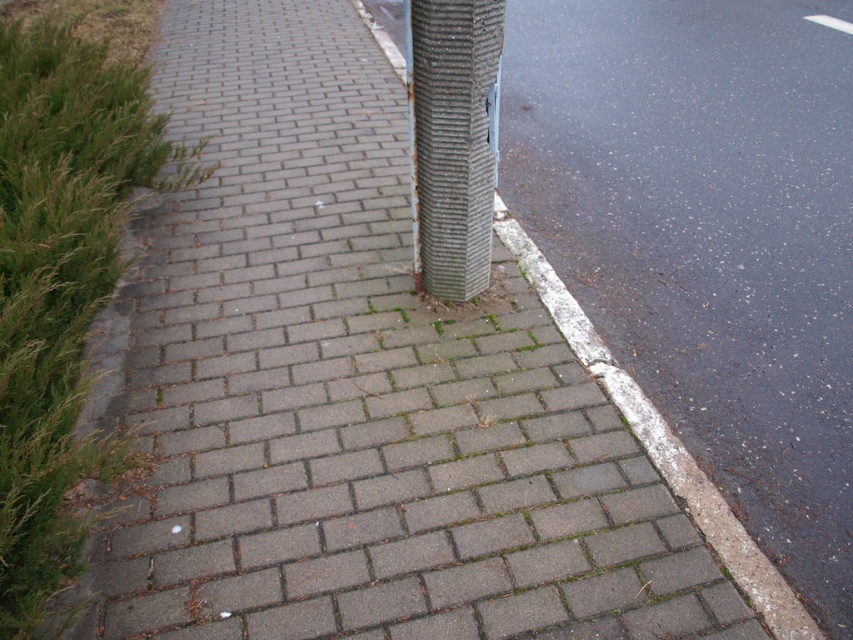
Is rough textured pole at center bigger than white concrete curb at lower right?

Incorrect, rough textured pole at center is not larger than white concrete curb at lower right.

Between rough textured pole at center and white concrete curb at lower right, which one has less height?

With less height is rough textured pole at center.

You are a GUI agent. You are given a task and a screenshot of the screen. Output one action in this format:
    pyautogui.click(x=<x>, y=<y>)
    Task: Click on the rough textured pole at center
    The width and height of the screenshot is (853, 640).
    Given the screenshot: What is the action you would take?
    pyautogui.click(x=451, y=140)